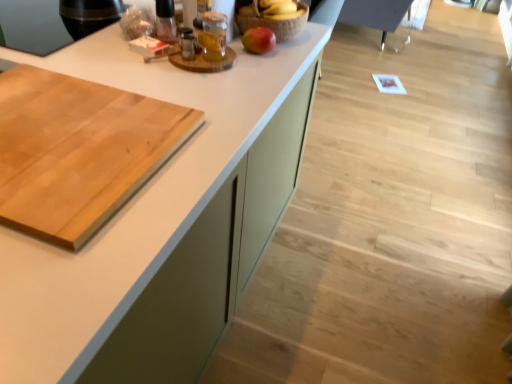
Question: Is translucent glass jar at upper center wider than red matte apple at upper center?

Choices:
 (A) yes
 (B) no

Answer: (B)

Question: From the image's perspective, is translucent glass jar at upper center over red matte apple at upper center?

Choices:
 (A) yes
 (B) no

Answer: (B)

Question: Is translucent glass jar at upper center at the left side of red matte apple at upper center?

Choices:
 (A) yes
 (B) no

Answer: (A)

Question: Could you tell me if translucent glass jar at upper center is turned towards red matte apple at upper center?

Choices:
 (A) yes
 (B) no

Answer: (B)

Question: Can you confirm if translucent glass jar at upper center is thinner than red matte apple at upper center?

Choices:
 (A) no
 (B) yes

Answer: (B)

Question: Is translucent glass jar at upper center placed right next to red matte apple at upper center?

Choices:
 (A) no
 (B) yes

Answer: (A)

Question: Is white matte countertop at center positioned far away from natural wood cutting board at left?

Choices:
 (A) no
 (B) yes

Answer: (A)

Question: Is white matte countertop at center turned away from natural wood cutting board at left?

Choices:
 (A) no
 (B) yes

Answer: (A)

Question: Considering the relative sizes of white matte countertop at center and natural wood cutting board at left in the image provided, is white matte countertop at center bigger than natural wood cutting board at left?

Choices:
 (A) no
 (B) yes

Answer: (B)

Question: Can you confirm if white matte countertop at center is wider than natural wood cutting board at left?

Choices:
 (A) yes
 (B) no

Answer: (A)

Question: From the image's perspective, is white matte countertop at center on natural wood cutting board at left?

Choices:
 (A) yes
 (B) no

Answer: (B)

Question: Does white matte countertop at center have a smaller size compared to natural wood cutting board at left?

Choices:
 (A) yes
 (B) no

Answer: (B)

Question: Does translucent glass jar at upper center have a lesser width compared to natural wood cutting board at left?

Choices:
 (A) yes
 (B) no

Answer: (A)